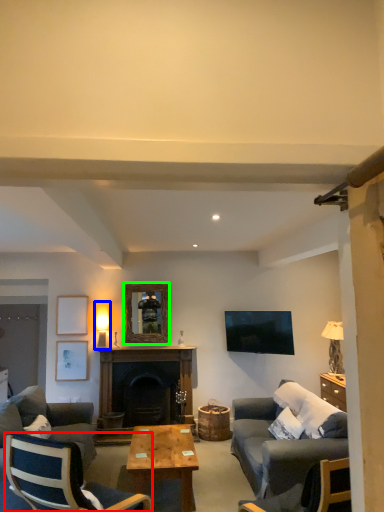
Question: Estimate the real-world distances between objects in this image. Which object is farther from chair (highlighted by a red box), lamp (highlighted by a blue box) or picture frame (highlighted by a green box)?

Choices:
 (A) lamp
 (B) picture frame

Answer: (A)